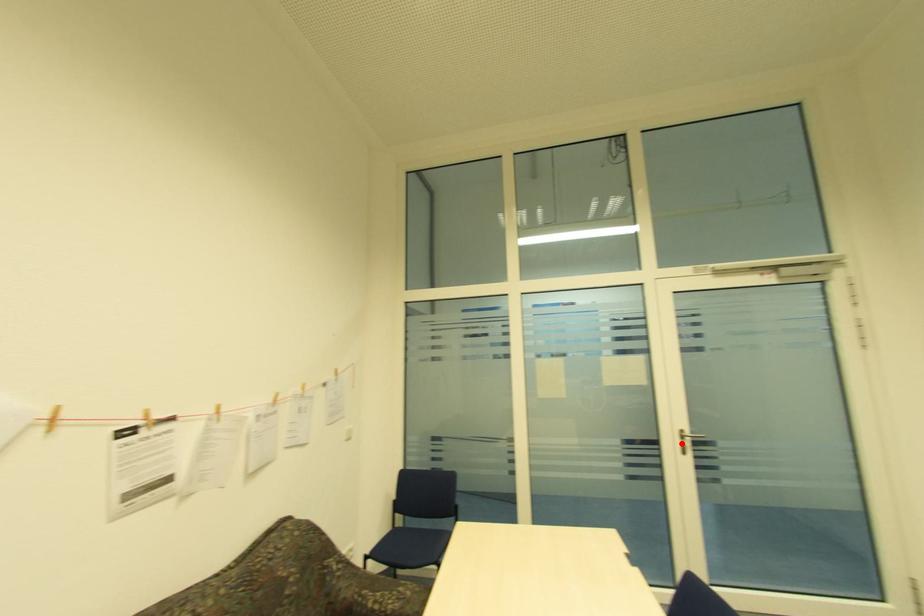
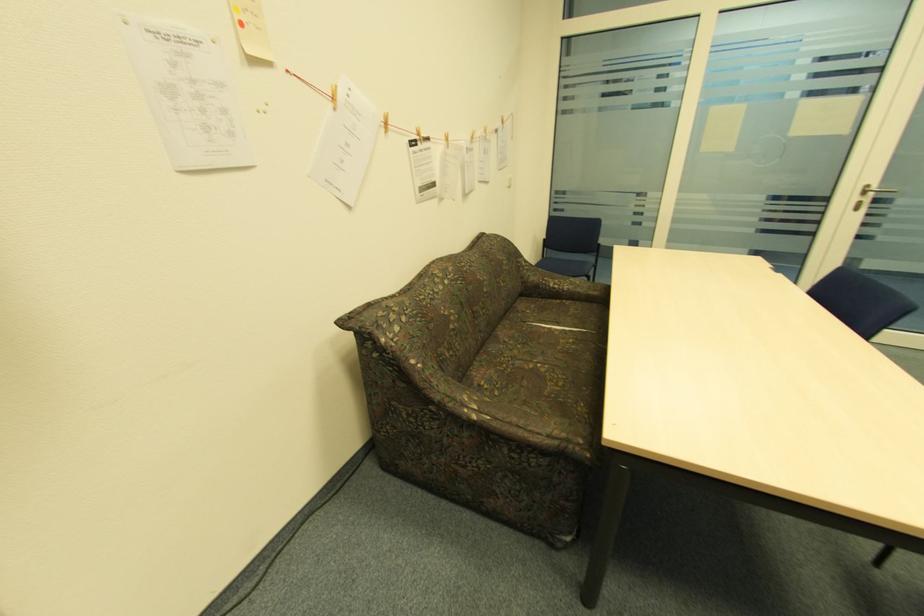
Question: A red point is marked in image1. In image2, is the corresponding 3D point closer to the camera or farther? Reply with the corresponding letter.

Choices:
 (A) The corresponding 3D point is closer.
 (B) The corresponding 3D point is farther.

Answer: (A)